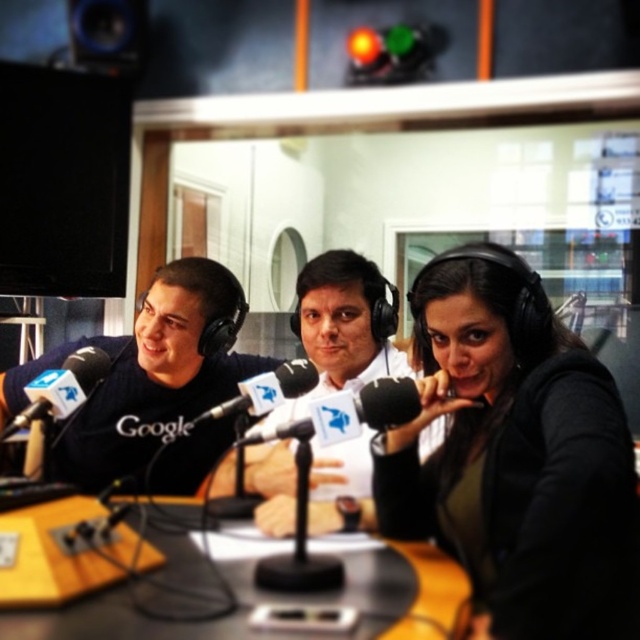
Question: Can you confirm if matte black shirt at center is smaller than black matte microphone at left?

Choices:
 (A) no
 (B) yes

Answer: (A)

Question: Which of the following is the farthest from the observer?

Choices:
 (A) (97, 381)
 (B) (160, 461)

Answer: (B)

Question: Can you confirm if matte black shirt at center is smaller than black matte microphone at left?

Choices:
 (A) yes
 (B) no

Answer: (B)

Question: Which object is farther from the camera taking this photo?

Choices:
 (A) yellow wood table at center
 (B) matte black shirt at center
 (C) black matte microphone at left
 (D) white plastic microphone at center

Answer: (B)

Question: Is yellow wood table at center bigger than black matte shirt at left?

Choices:
 (A) yes
 (B) no

Answer: (B)

Question: Which point appears closest to the camera in this image?

Choices:
 (A) (378, 508)
 (B) (330, 253)
 (C) (77, 0)
 (D) (371, 556)

Answer: (D)